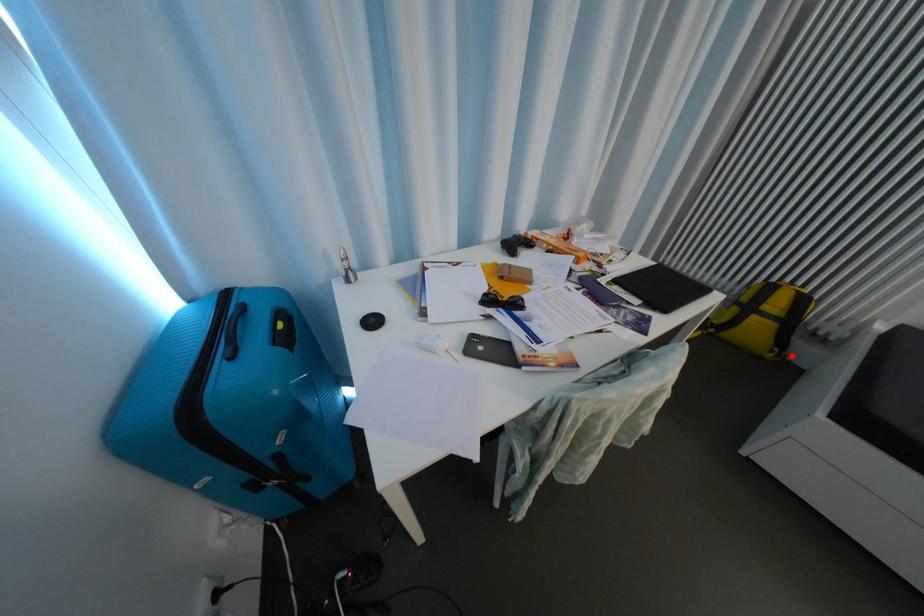
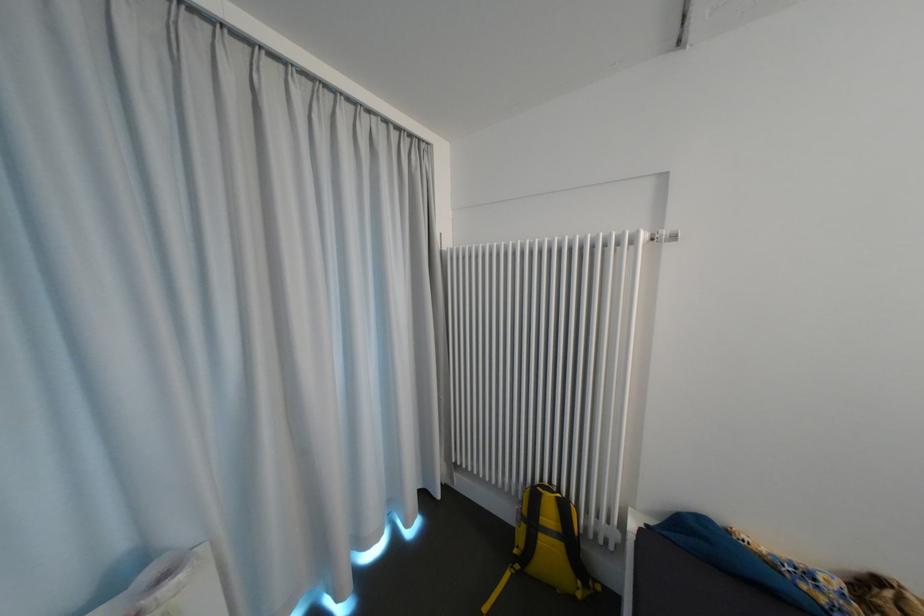
In the second image, find the point that corresponds to the highlighted location in the first image.

(599, 586)